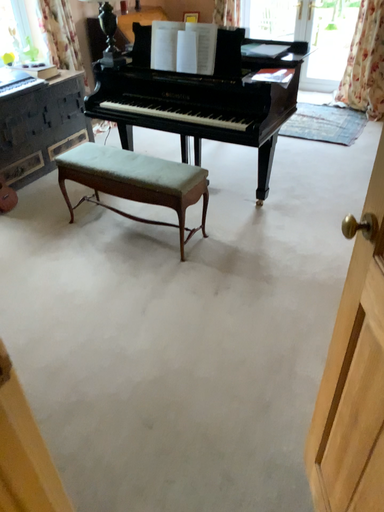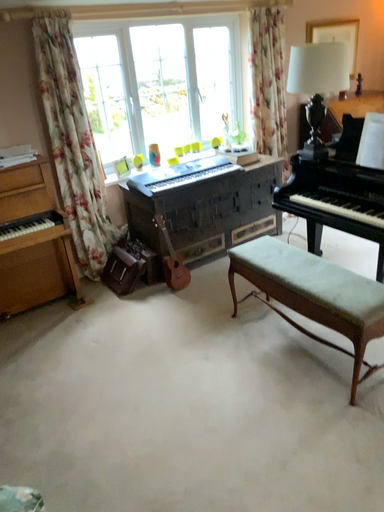
Question: Which way did the camera rotate in the video?

Choices:
 (A) rotated upward
 (B) rotated downward

Answer: (A)